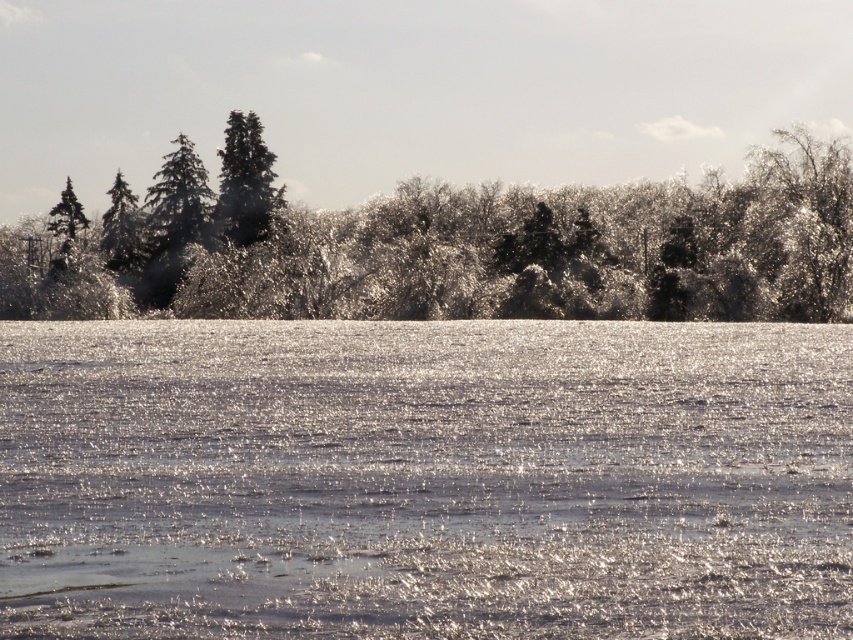
You are an ice skater planning to glide across the sparkling ice at center and the green matte tree at upper left. Which surface is wider for your path?

The sparkling ice at center is wider than the green matte tree at upper left, so you can glide on the sparkling ice at center for a wider path.

You are an artist sketching the winter scene. You notice the glossy evergreen trees at upper center and the green matte tree at upper left. Which tree is located to the right of the other?

The glossy evergreen trees at upper center is positioned on the right side of green matte tree at upper left.

You are standing at the bottom left corner of the image. Looking towards the upper center, can you see the glossy evergreen trees at upper center?

Yes, the glossy evergreen trees at upper center are located at point (457,248), so you can see them from the bottom left corner of the image.